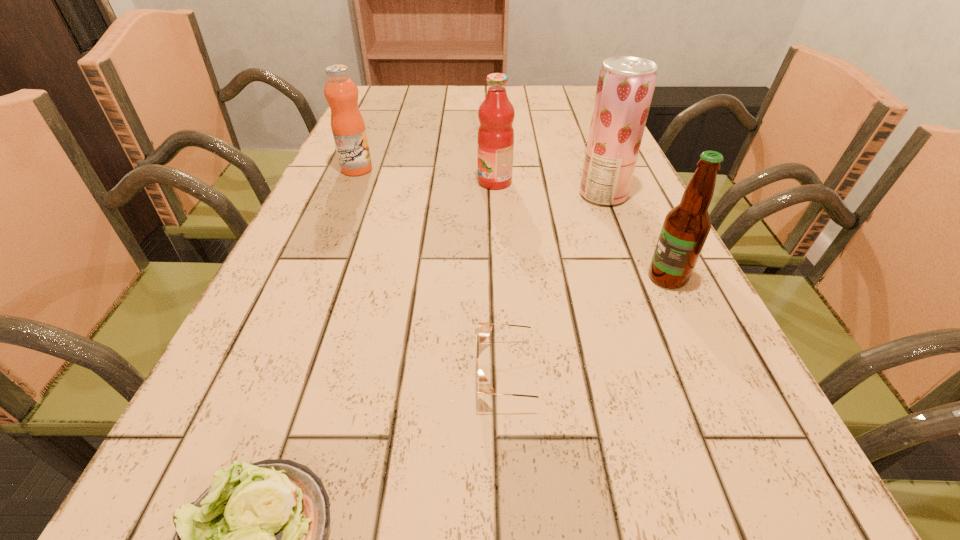
I want to click on free point located 0.310m on the label of the fourth farthest object, so click(476, 278).

Find the location of a particular element. vacant space located on the label of the fourth farthest object is located at coordinates (526, 278).

I want to click on vacant space located 0.200m on the right of the leftmost fruit juice, so click(x=453, y=169).

This screenshot has width=960, height=540. What are the coordinates of `free space located 0.180m on the front lenses of the sunglasses` in the screenshot? It's located at (353, 373).

Where is `vacant space situated on the front lenses of the sunglasses`? The width and height of the screenshot is (960, 540). vacant space situated on the front lenses of the sunglasses is located at coordinates (353, 373).

The image size is (960, 540). What are the coordinates of `vacant space located on the front lenses of the sunglasses` in the screenshot? It's located at (340, 373).

The width and height of the screenshot is (960, 540). Identify the location of object that is at the left edge. (347, 124).

Where is `fruit juice present at the right edge`? This screenshot has width=960, height=540. fruit juice present at the right edge is located at coordinates pos(625,87).

This screenshot has height=540, width=960. I want to click on beer bottle located at the right edge, so click(x=686, y=227).

Locate an element on the screen. This screenshot has height=540, width=960. free space at the far edge of the desktop is located at coordinates (429, 105).